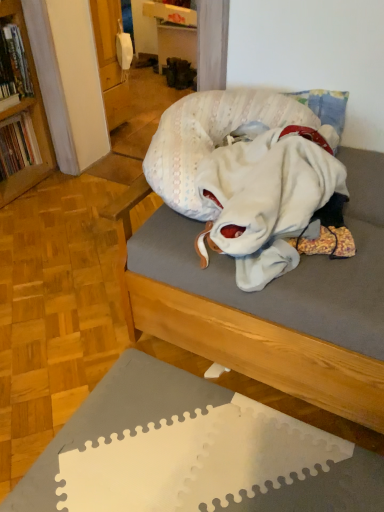
This screenshot has width=384, height=512. I want to click on wooden studio couch at center, so click(x=268, y=302).

What do you see at coordinates (268, 302) in the screenshot? I see `wooden studio couch at center` at bounding box center [268, 302].

Measure the distance between white cotton blanket at center and camera.

The depth of white cotton blanket at center is 37.76 inches.

Where is `white cotton blanket at center`? The width and height of the screenshot is (384, 512). white cotton blanket at center is located at coordinates (268, 187).

Find the location of a particular element. The width and height of the screenshot is (384, 512). hardcover book at left, which is counted as the 1th book, starting from the top is located at coordinates (14, 63).

Consider the image. In terms of size, does white textured pillow at center appear bigger or smaller than hardcover book at left, the 1th book from the bottom?

white textured pillow at center is bigger than hardcover book at left, the 1th book from the bottom.

How many degrees apart are the facing directions of white textured pillow at center and hardcover book at left, the 1th book from the bottom?

The facing directions of white textured pillow at center and hardcover book at left, the 1th book from the bottom, are 92.2 degrees apart.

Which is behind, point (182, 214) or point (14, 170)?

Positioned behind is point (14, 170).

Which object is further away from the camera taking this photo, white textured pillow at center or hardcover book at left, marked as the 2th book in a top-to-bottom arrangement?

Positioned behind is hardcover book at left, marked as the 2th book in a top-to-bottom arrangement.

Can you confirm if wooden studio couch at center is taller than hardcover book at left, the 1th book from the bottom?

Correct, wooden studio couch at center is much taller as hardcover book at left, the 1th book from the bottom.

Are wooden studio couch at center and hardcover book at left, the 1th book from the bottom, far apart?

Yes, wooden studio couch at center and hardcover book at left, the 1th book from the bottom, are quite far apart.

Which object is wider, wooden studio couch at center or hardcover book at left, the 1th book from the bottom?

wooden studio couch at center is wider.

Does white cotton blanket at center have a larger size compared to white textured pillow at center?

No, white cotton blanket at center is not bigger than white textured pillow at center.

From the image's perspective, would you say white cotton blanket at center is positioned over white textured pillow at center?

Actually, white cotton blanket at center appears below white textured pillow at center in the image.

Is white cotton blanket at center with white textured pillow at center?

white cotton blanket at center is not next to white textured pillow at center, and they're not touching.

Can you tell me how much white cotton blanket at center and white textured pillow at center differ in facing direction?

The facing directions of white cotton blanket at center and white textured pillow at center are 1.3 degrees apart.

How far apart are hardcover book at left, arranged as the second book when ordered from the bottom, and wooden studio couch at center?

A distance of 1.52 meters exists between hardcover book at left, arranged as the second book when ordered from the bottom, and wooden studio couch at center.

Can you tell me how much hardcover book at left, which is counted as the 1th book, starting from the top, and wooden studio couch at center differ in facing direction?

hardcover book at left, which is counted as the 1th book, starting from the top, and wooden studio couch at center are facing 91.8 degrees away from each other.

Is hardcover book at left, which is counted as the 1th book, starting from the top, oriented away from wooden studio couch at center?

No.

Does hardcover book at left, which is counted as the 1th book, starting from the top, contain wooden studio couch at center?

That's incorrect, wooden studio couch at center is not inside hardcover book at left, which is counted as the 1th book, starting from the top.

From the image's perspective, is hardcover book at left, the 1th book from the bottom, below white textured pillow at center?

No, from the image's perspective, hardcover book at left, the 1th book from the bottom, is not beneath white textured pillow at center.

Who is bigger, hardcover book at left, the 1th book from the bottom, or white textured pillow at center?

white textured pillow at center.

Is hardcover book at left, the 1th book from the bottom, far from white textured pillow at center?

hardcover book at left, the 1th book from the bottom, is positioned a significant distance from white textured pillow at center.

Considering the sizes of objects white textured pillow at center and white cotton blanket at center in the image provided, who is bigger, white textured pillow at center or white cotton blanket at center?

white textured pillow at center is bigger.

Would you say white textured pillow at center contains white cotton blanket at center?

No, white cotton blanket at center is not inside white textured pillow at center.

The height and width of the screenshot is (512, 384). Find the location of `clothing lying below the white textured pillow at center (from the image's perspective)`. clothing lying below the white textured pillow at center (from the image's perspective) is located at coordinates (268, 187).

Can you confirm if white textured pillow at center is taller than white cotton blanket at center?

Incorrect, the height of white textured pillow at center is not larger of that of white cotton blanket at center.

Is wooden studio couch at center taller than white cotton blanket at center?

Correct, wooden studio couch at center is much taller as white cotton blanket at center.

Which is more to the left, wooden studio couch at center or white cotton blanket at center?

Positioned to the left is white cotton blanket at center.

Who is more distant, wooden studio couch at center or white cotton blanket at center?

Positioned behind is white cotton blanket at center.

Which book is the 2nd one when counting from the left side of the white textured pillow at center? Please provide its 2D coordinates.

[(17, 145)]

The image size is (384, 512). What are the coordinates of `book directly beneath the wooden studio couch at center (from a real-world perspective)` in the screenshot? It's located at (17, 145).

Looking at this image, based on their spatial positions, is hardcover book at left, marked as the 2th book in a top-to-bottom arrangement, or white cotton blanket at center closer to hardcover book at left, which is counted as the 1th book, starting from the top?

The object closer to hardcover book at left, which is counted as the 1th book, starting from the top, is hardcover book at left, marked as the 2th book in a top-to-bottom arrangement.

From the image, which object appears to be nearer to white textured pillow at center, wooden studio couch at center or white cotton blanket at center?

white cotton blanket at center is positioned closer to the anchor white textured pillow at center.

From the image, which object appears to be nearer to hardcover book at left, marked as the 2th book in a top-to-bottom arrangement, white cotton blanket at center or wooden studio couch at center?

Based on the image, white cotton blanket at center appears to be nearer to hardcover book at left, marked as the 2th book in a top-to-bottom arrangement.

When comparing their distances from white cotton blanket at center, does hardcover book at left, marked as the 2th book in a top-to-bottom arrangement, or wooden studio couch at center seem closer?

wooden studio couch at center is positioned closer to the anchor white cotton blanket at center.

Which object lies further to the anchor point wooden studio couch at center, hardcover book at left, the 1th book from the bottom, or white cotton blanket at center?

hardcover book at left, the 1th book from the bottom.

When comparing their distances from white cotton blanket at center, does wooden studio couch at center or white textured pillow at center seem further?

wooden studio couch at center lies further to white cotton blanket at center than the other object.

When comparing their distances from hardcover book at left, the 1th book from the bottom, does white textured pillow at center or hardcover book at left, arranged as the second book when ordered from the bottom, seem closer?

Based on the image, hardcover book at left, arranged as the second book when ordered from the bottom, appears to be nearer to hardcover book at left, the 1th book from the bottom.

Based on their spatial positions, is wooden studio couch at center or hardcover book at left, marked as the 2th book in a top-to-bottom arrangement, further from white cotton blanket at center?

hardcover book at left, marked as the 2th book in a top-to-bottom arrangement, is further to white cotton blanket at center.

You are a GUI agent. You are given a task and a screenshot of the screen. Output one action in this format:
    pyautogui.click(x=<x>, y=<y>)
    Task: Click on the pillow between hardcover book at left, marked as the 2th book in a top-to-bottom arrangement, and wooden studio couch at center
    The height and width of the screenshot is (512, 384).
    Given the screenshot: What is the action you would take?
    pyautogui.click(x=211, y=139)

Identify the location of pillow located between hardcover book at left, which is counted as the 1th book, starting from the top, and white cotton blanket at center in the left-right direction. The width and height of the screenshot is (384, 512). (211, 139).

Where is `clothing between hardcover book at left, arranged as the second book when ordered from the bottom, and wooden studio couch at center from left to right`? The width and height of the screenshot is (384, 512). clothing between hardcover book at left, arranged as the second book when ordered from the bottom, and wooden studio couch at center from left to right is located at coordinates (268, 187).

Identify the location of clothing that lies between white textured pillow at center and wooden studio couch at center from top to bottom. The height and width of the screenshot is (512, 384). (268, 187).